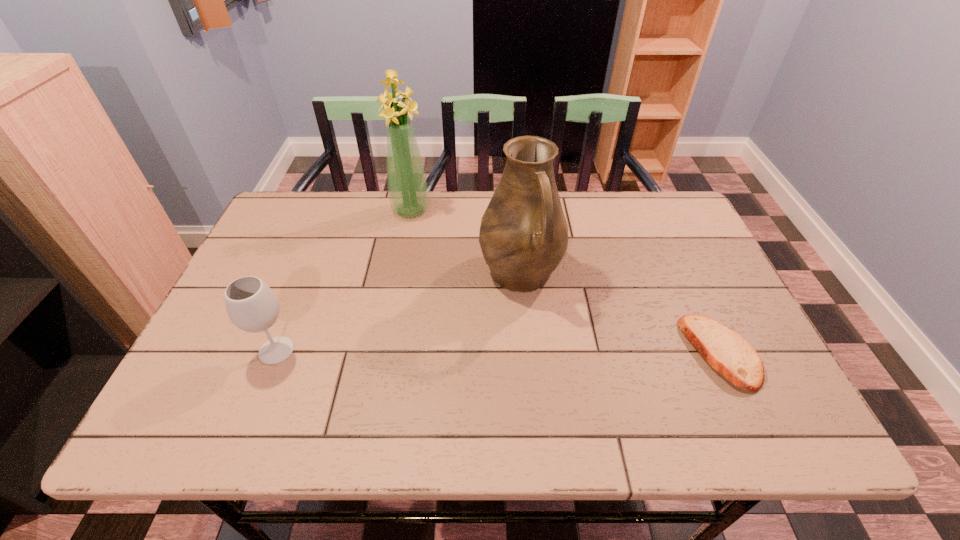
Where is `vacant space that satisfies the following two spatial constraints: 1. on the front side of the pita bread; 2. on the left side of the third object from right to left`? This screenshot has height=540, width=960. vacant space that satisfies the following two spatial constraints: 1. on the front side of the pita bread; 2. on the left side of the third object from right to left is located at coordinates pyautogui.click(x=385, y=353).

This screenshot has width=960, height=540. I want to click on vacant space that satisfies the following two spatial constraints: 1. on the back side of the bouquet; 2. on the left side of the wineglass, so click(332, 211).